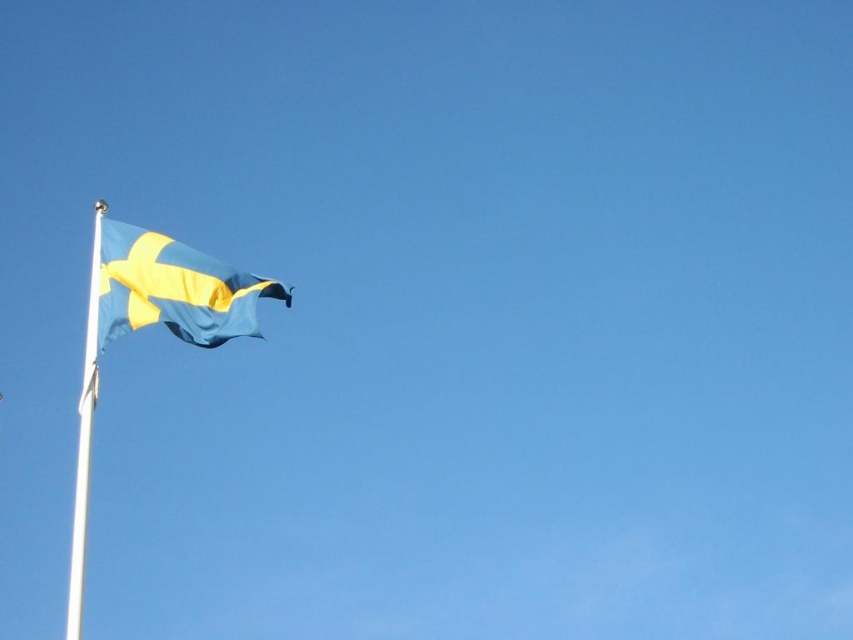
Between point (160, 246) and point (94, 288), which one is positioned in front?

Point (94, 288)

Is blue fabric flag at upper left thinner than white metallic flag pole at left?

Indeed, blue fabric flag at upper left has a lesser width compared to white metallic flag pole at left.

Who is more distant from viewer, [171,326] or [68,620]?

The point [68,620] is more distant.

Identify the location of blue fabric flag at upper left. (173, 289).